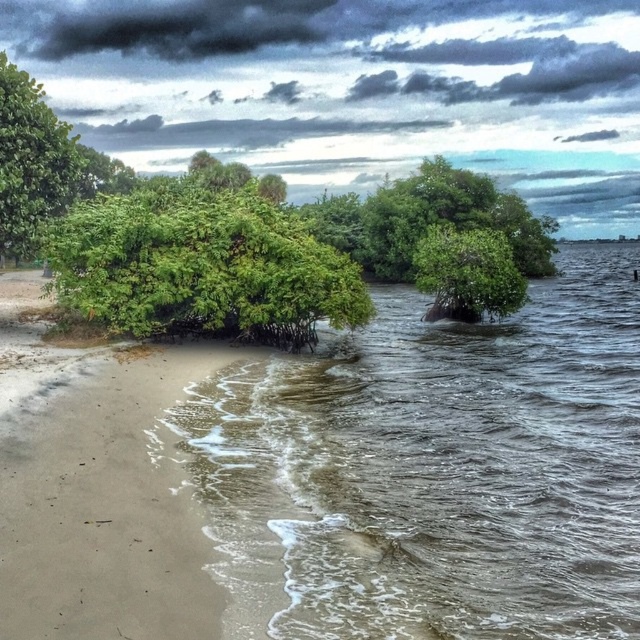
Question: Which object is farther from the camera taking this photo?

Choices:
 (A) green leafy bush at left
 (B) green leafy tree at center
 (C) brown murky water at center
 (D) green leafy tree at left

Answer: (B)

Question: Which point appears farthest from the camera in this image?

Choices:
 (A) (564, 356)
 (B) (488, 278)

Answer: (B)

Question: Among these points, which one is farthest from the camera?

Choices:
 (A) (67, 157)
 (B) (323, 248)

Answer: (B)

Question: Observing the image, what is the correct spatial positioning of brown murky water at center in reference to green leafy tree at left?

Choices:
 (A) left
 (B) right

Answer: (B)

Question: Is brown murky water at center to the right of green leafy tree at left from the viewer's perspective?

Choices:
 (A) yes
 (B) no

Answer: (A)

Question: Is the position of green leafy bush at left more distant than that of green leafy tree at center?

Choices:
 (A) yes
 (B) no

Answer: (B)